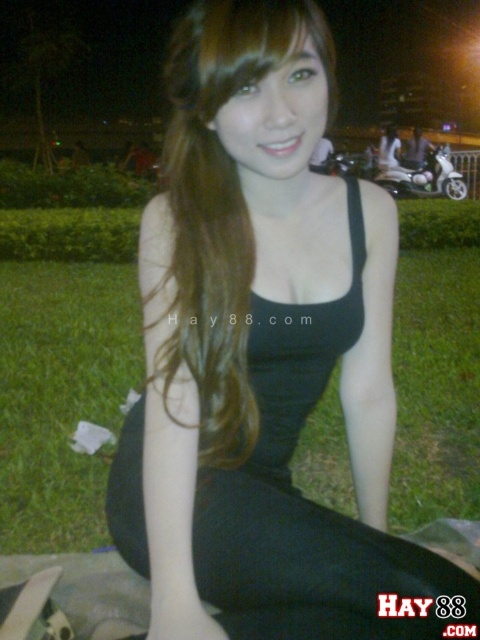
Which is more to the right, green grass at lower center or white glossy motorcycle at right?

white glossy motorcycle at right is more to the right.

Does green grass at lower center have a lesser height compared to white glossy motorcycle at right?

Yes, green grass at lower center is shorter than white glossy motorcycle at right.

Who is more distant from viewer, (119, 346) or (406, 172)?

Point (406, 172)

The image size is (480, 640). In order to click on green grass at lower center in this screenshot , I will do `click(60, 396)`.

Which is more to the right, green grass at lower center or black matte dress at center?

Positioned to the right is green grass at lower center.

Describe the element at coordinates (60, 396) in the screenshot. I see `green grass at lower center` at that location.

At what (x,y) coordinates should I click in order to perform the action: click on green grass at lower center. Please return your answer as a coordinate pair (x, y). Looking at the image, I should click on (60, 396).

Who is shorter, black matte dress at center or white glossy motorcycle at right?

black matte dress at center

Can you confirm if black matte dress at center is positioned to the right of white glossy motorcycle at right?

No, black matte dress at center is not to the right of white glossy motorcycle at right.

Find the location of a particular element. black matte dress at center is located at coordinates (219, 205).